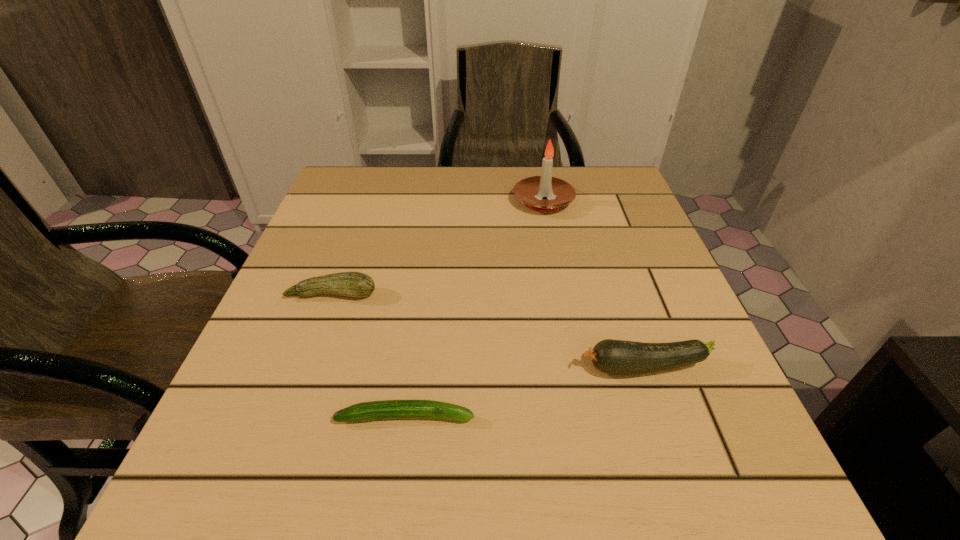
Find the location of `vacant space that's between the third farthest object and the shortest object`. vacant space that's between the third farthest object and the shortest object is located at coordinates (525, 392).

Find the location of a particular element. The image size is (960, 540). vacant space in between the second nearest zucchini and the shortest zucchini is located at coordinates tap(525, 392).

Locate an element on the screen. vacant region between the farthest object and the farthest zucchini is located at coordinates (438, 248).

Where is `vacant area that lies between the nearest object and the second tallest zucchini`? This screenshot has height=540, width=960. vacant area that lies between the nearest object and the second tallest zucchini is located at coordinates (369, 355).

The image size is (960, 540). I want to click on free space between the second shortest object and the third farthest object, so click(489, 331).

Locate an element on the screen. object that is the third closest one to the farthest object is located at coordinates (387, 409).

Identify which object is the second nearest to the nearest zucchini. Please provide its 2D coordinates. Your answer should be formatted as a tuple, i.e. [(x, y)], where the tuple contains the x and y coordinates of a point satisfying the conditions above.

[(351, 284)]

Point out which zucchini is positioned as the second nearest to the tallest object. Please provide its 2D coordinates. Your answer should be formatted as a tuple, i.e. [(x, y)], where the tuple contains the x and y coordinates of a point satisfying the conditions above.

[(615, 357)]

Locate an element on the screen. the closest zucchini to the second farthest zucchini is located at coordinates (387, 409).

You are a GUI agent. You are given a task and a screenshot of the screen. Output one action in this format:
    pyautogui.click(x=<x>, y=<y>)
    Task: Click on the free space that satisfies the following two spatial constraints: 1. on the front side of the tallest object; 2. on the front-facing side of the shortest zucchini
    The height and width of the screenshot is (540, 960).
    Given the screenshot: What is the action you would take?
    pyautogui.click(x=586, y=416)